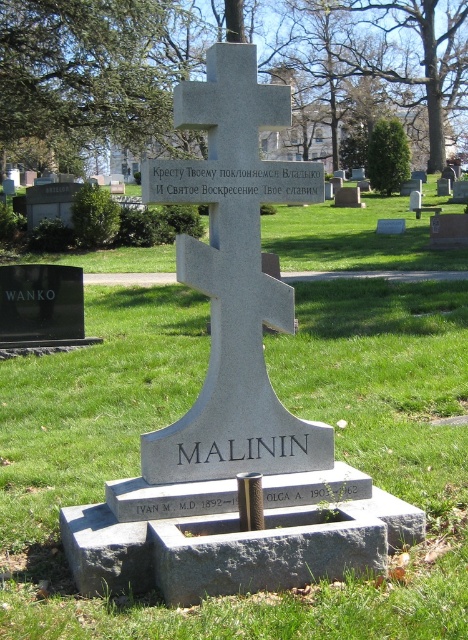
The width and height of the screenshot is (468, 640). Describe the element at coordinates (287, 406) in the screenshot. I see `green grass at center` at that location.

Who is shorter, green grass at center or gray stone cross at center?

Standing shorter between the two is gray stone cross at center.

This screenshot has width=468, height=640. I want to click on green grass at center, so click(x=287, y=406).